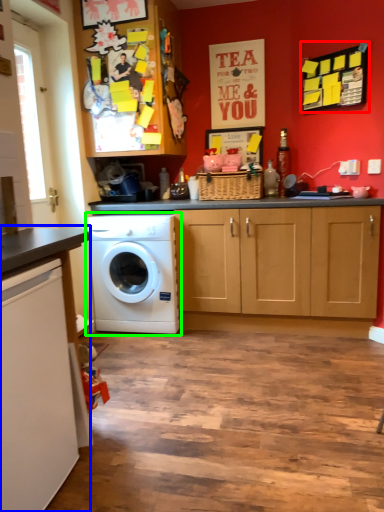
Question: Considering the real-world distances, which object is closest to bulletin board (highlighted by a red box)? countertop (highlighted by a blue box) or washing machine (highlighted by a green box).

Choices:
 (A) countertop
 (B) washing machine

Answer: (B)